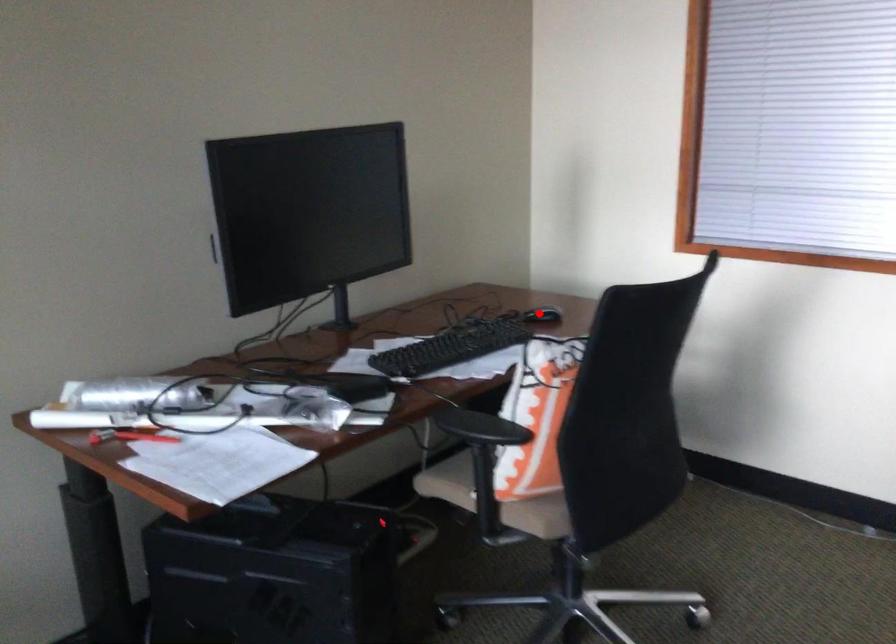
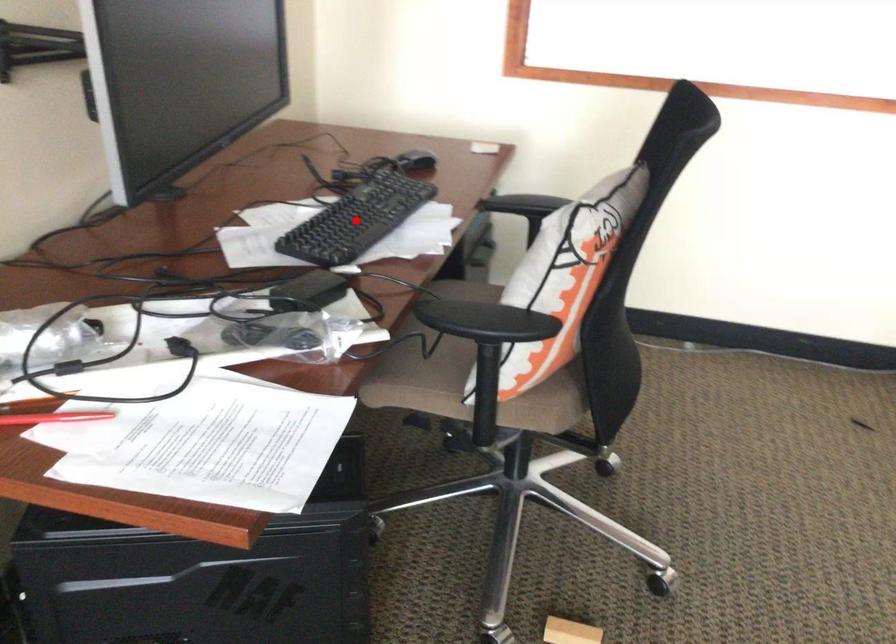
I am providing you with two images of the same scene from different viewpoints. A red point is marked on the first image and another point is marked on the second image. Do the highlighted points in image1 and image2 indicate the same real-world spot?

No